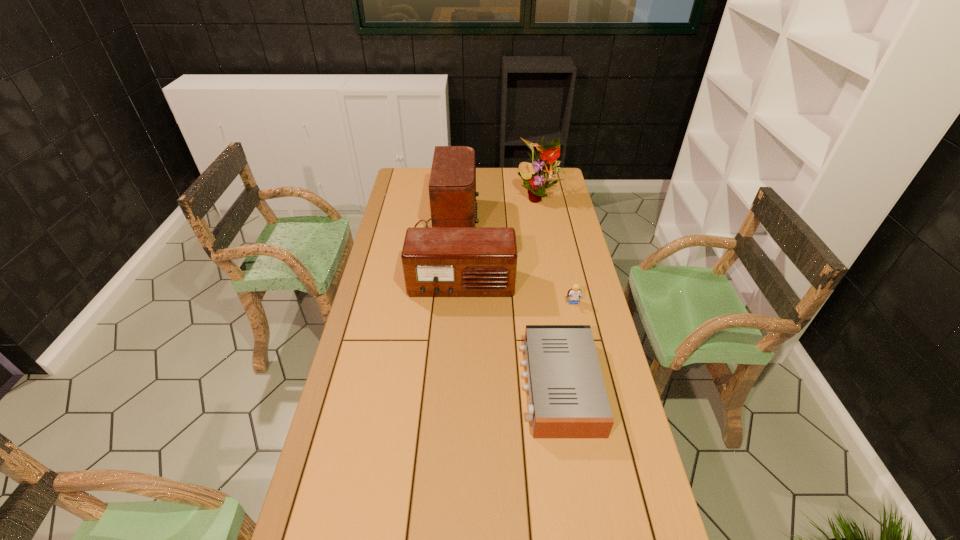
The height and width of the screenshot is (540, 960). Find the location of `free spot at the left edge of the desktop`. free spot at the left edge of the desktop is located at coordinates (406, 221).

The width and height of the screenshot is (960, 540). What are the coordinates of `blank space at the right edge` in the screenshot? It's located at (566, 252).

Where is `vacant space that is in between the nearest object and the bouquet`? Image resolution: width=960 pixels, height=540 pixels. vacant space that is in between the nearest object and the bouquet is located at coordinates (549, 291).

Where is `free spot between the bouquet and the Lego`? This screenshot has height=540, width=960. free spot between the bouquet and the Lego is located at coordinates (556, 250).

Locate an element on the screen. This screenshot has width=960, height=540. vacant area between the second farthest radio receiver and the Lego is located at coordinates (517, 294).

Identify the location of the closest object to the second farthest radio receiver. The height and width of the screenshot is (540, 960). (452, 186).

Identify which object is the second nearest to the Lego. Please provide its 2D coordinates. Your answer should be formatted as a tuple, i.e. [(x, y)], where the tuple contains the x and y coordinates of a point satisfying the conditions above.

[(437, 262)]

Identify which radio receiver is the third nearest to the Lego. Please provide its 2D coordinates. Your answer should be formatted as a tuple, i.e. [(x, y)], where the tuple contains the x and y coordinates of a point satisfying the conditions above.

[(452, 186)]

Select which radio receiver appears as the closest to the tallest radio receiver. Please provide its 2D coordinates. Your answer should be formatted as a tuple, i.e. [(x, y)], where the tuple contains the x and y coordinates of a point satisfying the conditions above.

[(437, 262)]

Find the location of a particular element. The image size is (960, 540). vacant space that satisfies the following two spatial constraints: 1. on the front-facing side of the bouquet; 2. on the front panel of the farthest radio receiver is located at coordinates [542, 219].